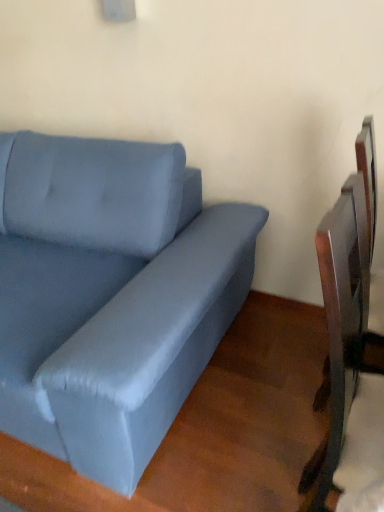
Locate an element on the screen. free spot below metallic silver swivel chair at right (from a real-world perspective) is located at coordinates (324, 390).